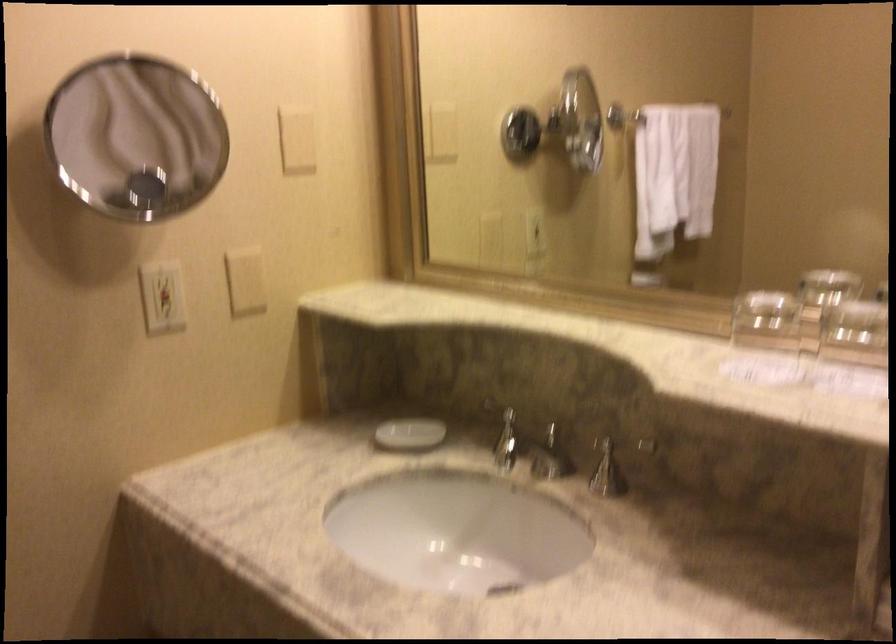
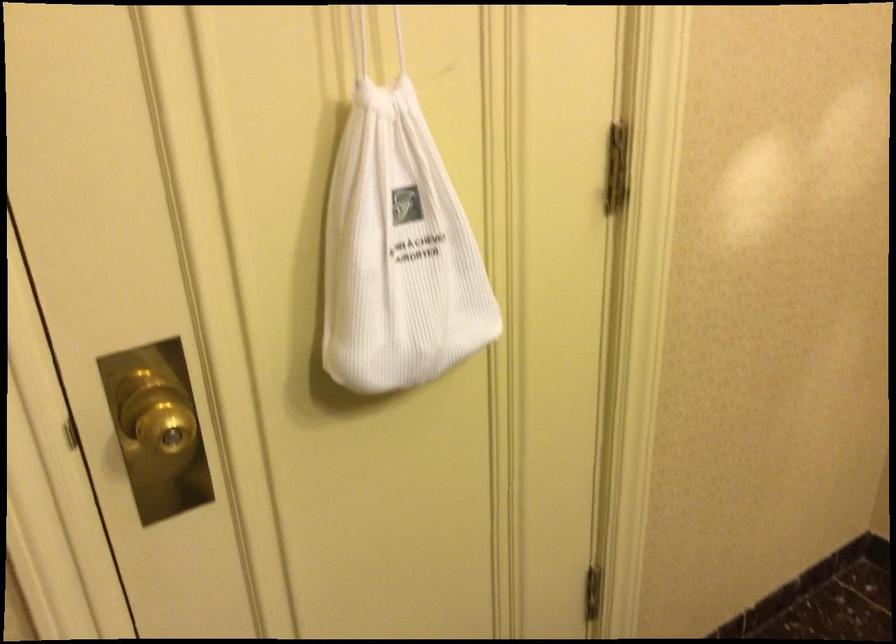
Based on the continuous images, in which direction is the camera rotating?

The camera rotated toward left-down.